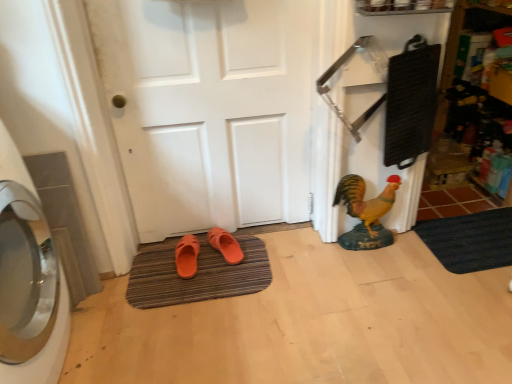
Identify the location of free area in between orange rubber slipper at lower center, positioned as the first footwear in left-to-right order, and orange matte slippers at center, arranged as the 2th footwear when viewed from the left. (207, 266).